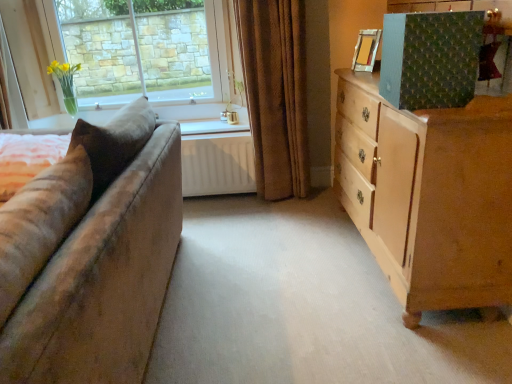
What do you see at coordinates (275, 93) in the screenshot? I see `brown velvet curtain at center` at bounding box center [275, 93].

Describe the element at coordinates (366, 50) in the screenshot. Image resolution: width=512 pixels, height=384 pixels. I see `wooden picture frame at upper right` at that location.

I want to click on wooden picture frame at upper right, so click(x=366, y=50).

You are a GUI agent. You are given a task and a screenshot of the screen. Output one action in this format:
    pyautogui.click(x=<x>, y=<y>)
    Task: Click on the brown velvet curtain at center
    The image size is (512, 384).
    Given the screenshot: What is the action you would take?
    pyautogui.click(x=275, y=93)

Is brown velvet curtain at center looking in the opposite direction of wooden picture frame at upper right?

No, wooden picture frame at upper right is not at the back of brown velvet curtain at center.

From the image's perspective, is brown velvet curtain at center below wooden picture frame at upper right?

Yes, from the image's perspective, brown velvet curtain at center is below wooden picture frame at upper right.

Considering the positions of objects brown velvet curtain at center and wooden picture frame at upper right in the image provided, who is more to the left, brown velvet curtain at center or wooden picture frame at upper right?

brown velvet curtain at center is more to the left.

Considering the sizes of light brown wooden chest of drawers at right and clear glass vase at upper left in the image, is light brown wooden chest of drawers at right bigger or smaller than clear glass vase at upper left?

Considering their sizes, light brown wooden chest of drawers at right takes up more space than clear glass vase at upper left.

Could you tell me if light brown wooden chest of drawers at right is turned towards clear glass vase at upper left?

No, light brown wooden chest of drawers at right is not oriented towards clear glass vase at upper left.

What's the angular difference between light brown wooden chest of drawers at right and clear glass vase at upper left's facing directions?

The facing directions of light brown wooden chest of drawers at right and clear glass vase at upper left are 90.3 degrees apart.

From the image's perspective, is light brown wooden chest of drawers at right above clear glass vase at upper left?

No, from the image's perspective, light brown wooden chest of drawers at right is not over clear glass vase at upper left.

Is brown velvet curtain at center oriented away from light brown wooden chest of drawers at right?

brown velvet curtain at center does not have its back to light brown wooden chest of drawers at right.

From the picture: Is brown velvet curtain at center shorter than light brown wooden chest of drawers at right?

Incorrect, the height of brown velvet curtain at center does not fall short of that of light brown wooden chest of drawers at right.

Find the location of a particular element. This screenshot has width=512, height=384. chest of drawers below the brown velvet curtain at center (from a real-world perspective) is located at coordinates (434, 196).

Which of these two, brown velvet curtain at center or light brown wooden chest of drawers at right, is bigger?

Bigger between the two is light brown wooden chest of drawers at right.

Between wooden picture frame at upper right and brown velvet curtain at center, which one has less height?

With less height is wooden picture frame at upper right.

Find the location of a particular element. curtain behind the wooden picture frame at upper right is located at coordinates (275, 93).

Is wooden picture frame at upper right positioned behind brown velvet curtain at center?

No, wooden picture frame at upper right is closer to the camera.

Is point (359, 41) closer or farther from the camera than point (256, 122)?

Point (359, 41).

From the image's perspective, between wooden picture frame at upper right and light brown wooden chest of drawers at right, which one is located above?

wooden picture frame at upper right.

Who is bigger, wooden picture frame at upper right or light brown wooden chest of drawers at right?

Bigger between the two is light brown wooden chest of drawers at right.

Based on their positions, is wooden picture frame at upper right located to the left or right of light brown wooden chest of drawers at right?

wooden picture frame at upper right is to the left of light brown wooden chest of drawers at right.

In terms of width, does wooden picture frame at upper right look wider or thinner when compared to light brown wooden chest of drawers at right?

In the image, wooden picture frame at upper right appears to be more narrow than light brown wooden chest of drawers at right.

Can you confirm if light brown wooden chest of drawers at right is shorter than white matte radiator at center?

No, light brown wooden chest of drawers at right is not shorter than white matte radiator at center.

From a real-world perspective, is light brown wooden chest of drawers at right beneath white matte radiator at center?

No, from a real-world perspective, light brown wooden chest of drawers at right is not under white matte radiator at center.

At what (x,y) coordinates should I click in order to perform the action: click on radiator that appears below the light brown wooden chest of drawers at right (from a real-world perspective). Please return your answer as a coordinate pair (x, y). The height and width of the screenshot is (384, 512). Looking at the image, I should click on (217, 164).

Which point is more forward, (x=487, y=289) or (x=294, y=127)?

The point (x=487, y=289) is in front.

You are a GUI agent. You are given a task and a screenshot of the screen. Output one action in this format:
    pyautogui.click(x=<x>, y=<y>)
    Task: Click on the chest of drawers on the right side of brown velvet curtain at center
    The width and height of the screenshot is (512, 384).
    Given the screenshot: What is the action you would take?
    pyautogui.click(x=434, y=196)

From the image's perspective, who appears lower, light brown wooden chest of drawers at right or brown velvet curtain at center?

light brown wooden chest of drawers at right.

Is light brown wooden chest of drawers at right looking in the opposite direction of brown velvet curtain at center?

light brown wooden chest of drawers at right does not have its back to brown velvet curtain at center.

This screenshot has width=512, height=384. Identify the location of picture frame in front of the brown velvet curtain at center. (366, 50).

Identify the location of window above the light brown wooden chest of drawers at right (from the image's perspective). (141, 49).

From the image, which object appears to be nearer to clear glass vase at upper left, wooden picture frame at upper right or light brown wooden chest of drawers at right?

wooden picture frame at upper right lies closer to clear glass vase at upper left than the other object.

When comparing their distances from wooden picture frame at upper right, does clear glass vase at upper left or light brown wooden chest of drawers at right seem further?

clear glass vase at upper left is further to wooden picture frame at upper right.

When comparing their distances from white matte radiator at center, does light brown wooden chest of drawers at right or brown velvet curtain at center seem further?

Among the two, light brown wooden chest of drawers at right is located further to white matte radiator at center.

Looking at the image, which one is located closer to brown velvet curtain at center, light brown wooden chest of drawers at right or white matte radiator at center?

The object closer to brown velvet curtain at center is white matte radiator at center.

When comparing their distances from brown velvet curtain at center, does white matte radiator at center or light brown wooden chest of drawers at right seem closer?

white matte radiator at center.

When comparing their distances from wooden picture frame at upper right, does white matte radiator at center or brown velvet curtain at center seem further?

→ white matte radiator at center is positioned further to the anchor wooden picture frame at upper right.

Based on their spatial positions, is brown velvet curtain at center or light brown wooden chest of drawers at right closer to wooden picture frame at upper right?

brown velvet curtain at center is positioned closer to the anchor wooden picture frame at upper right.

Considering their positions, is wooden picture frame at upper right positioned closer to white matte radiator at center than light brown wooden chest of drawers at right?

wooden picture frame at upper right lies closer to white matte radiator at center than the other object.

Where is `curtain between light brown wooden chest of drawers at right and white matte radiator at center along the z-axis`? curtain between light brown wooden chest of drawers at right and white matte radiator at center along the z-axis is located at coordinates (275, 93).

The height and width of the screenshot is (384, 512). In order to click on picture frame between clear glass vase at upper left and light brown wooden chest of drawers at right in this screenshot , I will do `click(366, 50)`.

This screenshot has width=512, height=384. I want to click on picture frame positioned between light brown wooden chest of drawers at right and white matte radiator at center from near to far, so click(x=366, y=50).

I want to click on picture frame between light brown wooden chest of drawers at right and brown velvet curtain at center along the z-axis, so click(366, 50).